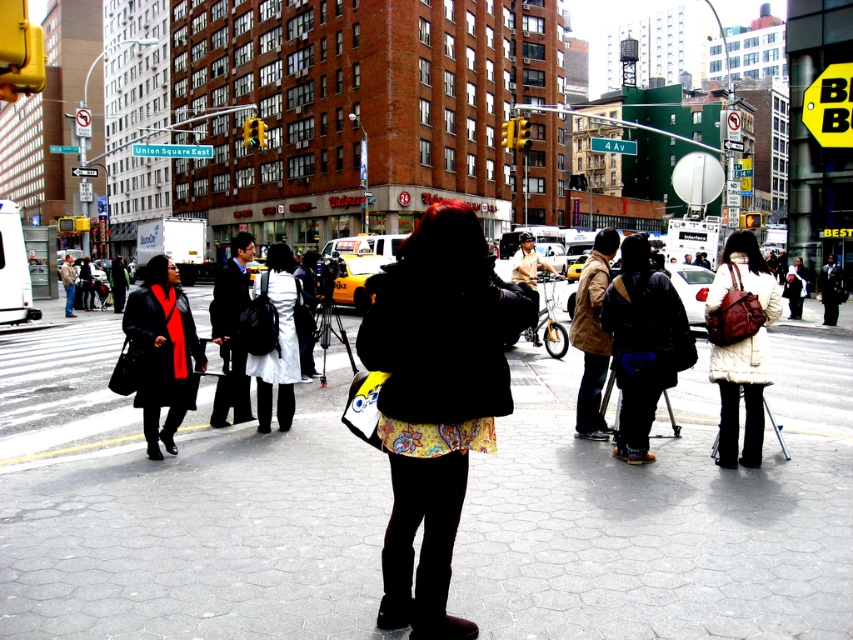
Question: Which point is closer to the camera taking this photo?

Choices:
 (A) (189, 330)
 (B) (755, 365)
 (C) (303, 612)
 (D) (422, 276)

Answer: (D)

Question: Among these objects, which one is nearest to the camera?

Choices:
 (A) black leather coat at left
 (B) white fuzzy coat at center

Answer: (B)

Question: Among these objects, which one is farthest from the camera?

Choices:
 (A) white cotton coat at center
 (B) smooth concrete pavement at center

Answer: (A)

Question: Observing the image, what is the correct spatial positioning of black leather coat at left in reference to white fuzzy coat at center?

Choices:
 (A) below
 (B) above

Answer: (A)

Question: Can you confirm if floral-patterned skirt at center is positioned below white fuzzy coat at center?

Choices:
 (A) yes
 (B) no

Answer: (A)

Question: In this image, where is smooth concrete pavement at center located relative to floral-patterned skirt at center?

Choices:
 (A) right
 (B) left

Answer: (B)